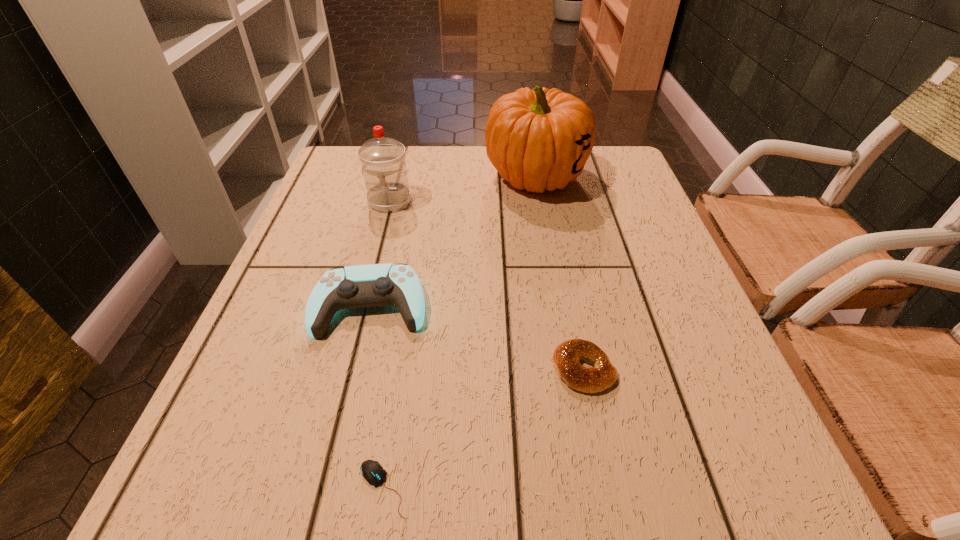
Where is `free space that is in between the tallest object and the nearest object`? free space that is in between the tallest object and the nearest object is located at coordinates (460, 332).

Locate an element on the screen. The width and height of the screenshot is (960, 540). free space between the nearest object and the second tallest object is located at coordinates (386, 345).

Locate an element on the screen. Image resolution: width=960 pixels, height=540 pixels. free space between the control and the fourth tallest object is located at coordinates (477, 338).

Locate an element on the screen. The height and width of the screenshot is (540, 960). free space between the fourth shortest object and the control is located at coordinates (380, 253).

Find the location of a particular element. Image resolution: width=960 pixels, height=540 pixels. unoccupied position between the second nearest object and the shortest object is located at coordinates (483, 429).

Find the location of `free space between the second tallest object and the third shortest object`. free space between the second tallest object and the third shortest object is located at coordinates (380, 253).

This screenshot has width=960, height=540. I want to click on free space between the second nearest object and the tallest object, so click(x=560, y=273).

The height and width of the screenshot is (540, 960). I want to click on free spot between the second shortest object and the third tallest object, so click(477, 338).

Choose which object is the nearest neighbor to the tallest object. Please provide its 2D coordinates. Your answer should be formatted as a tuple, i.e. [(x, y)], where the tuple contains the x and y coordinates of a point satisfying the conditions above.

[(383, 160)]

The width and height of the screenshot is (960, 540). Identify the location of the third closest object to the shortest object. (383, 160).